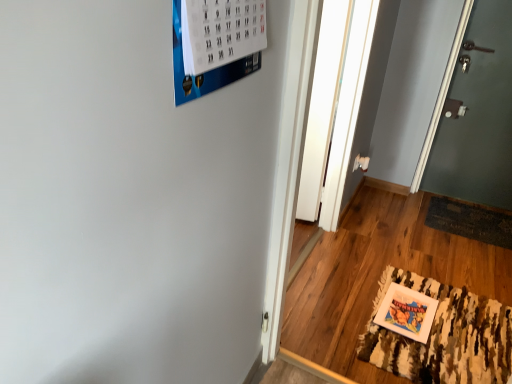
Image resolution: width=512 pixels, height=384 pixels. What are the coordinates of `free space above white matte picture frame at lower right (from a real-world perspective)` in the screenshot? It's located at (405, 305).